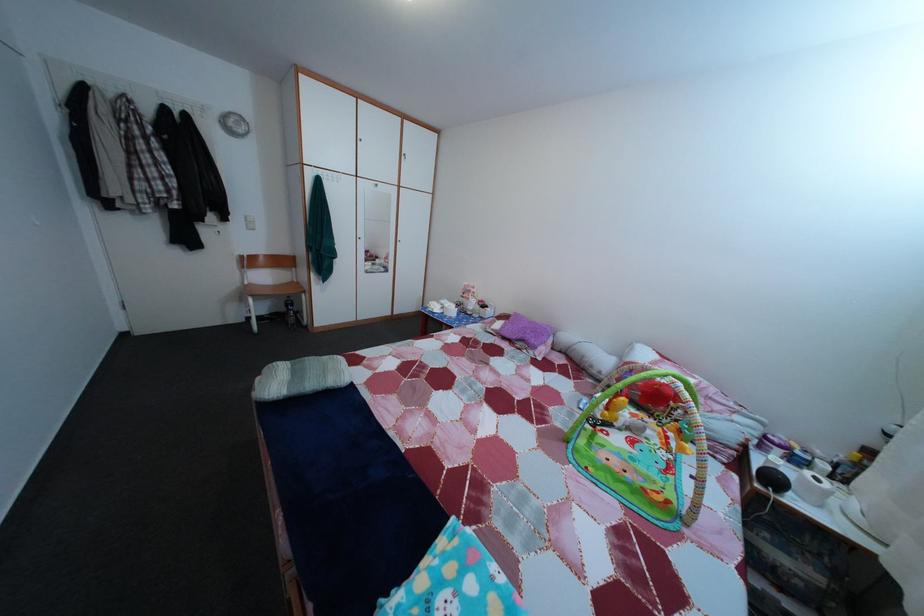
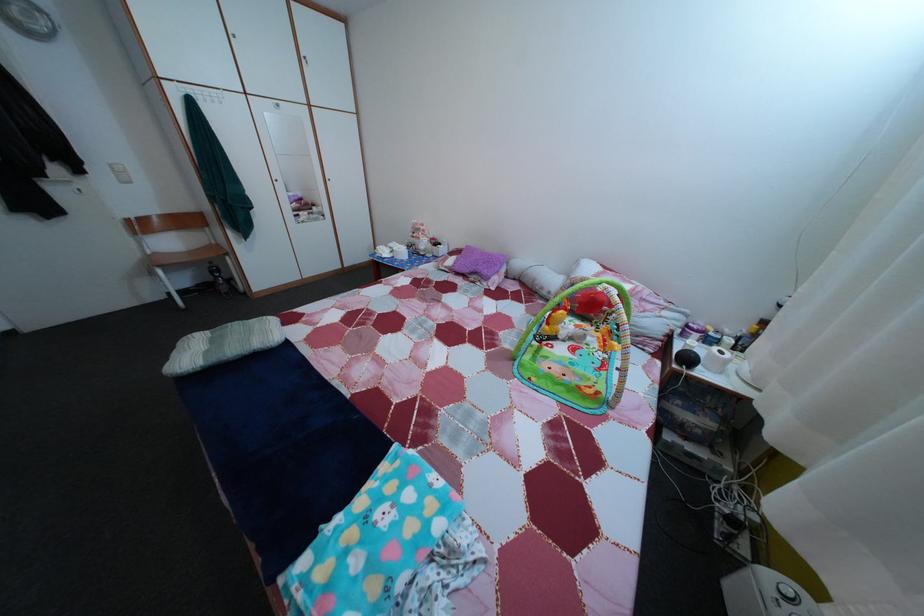
In the second image, find the point that corresponds to the point at 767,469 in the first image.

(687, 354)